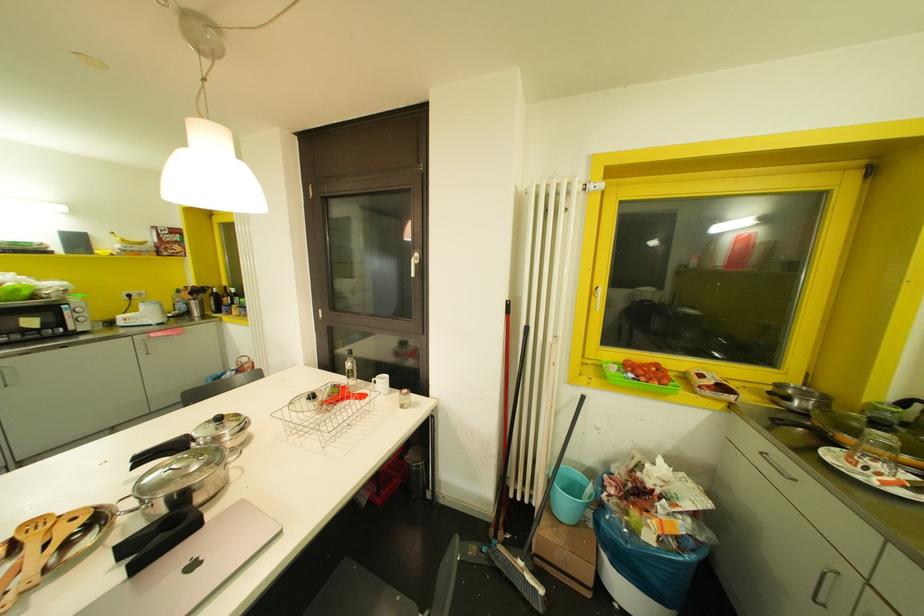
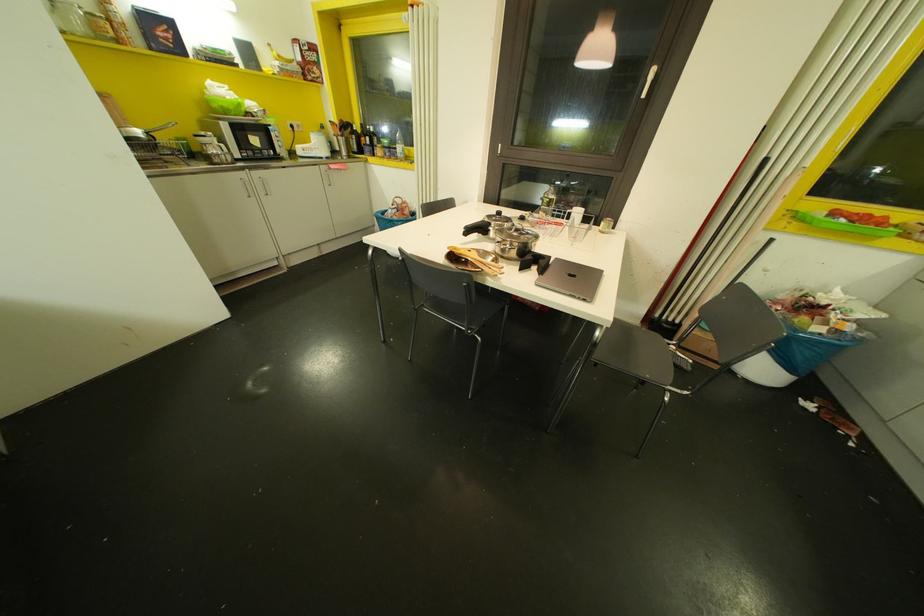
What movement of the cameraman would produce the second image?

The cameraman walked toward left, backward.